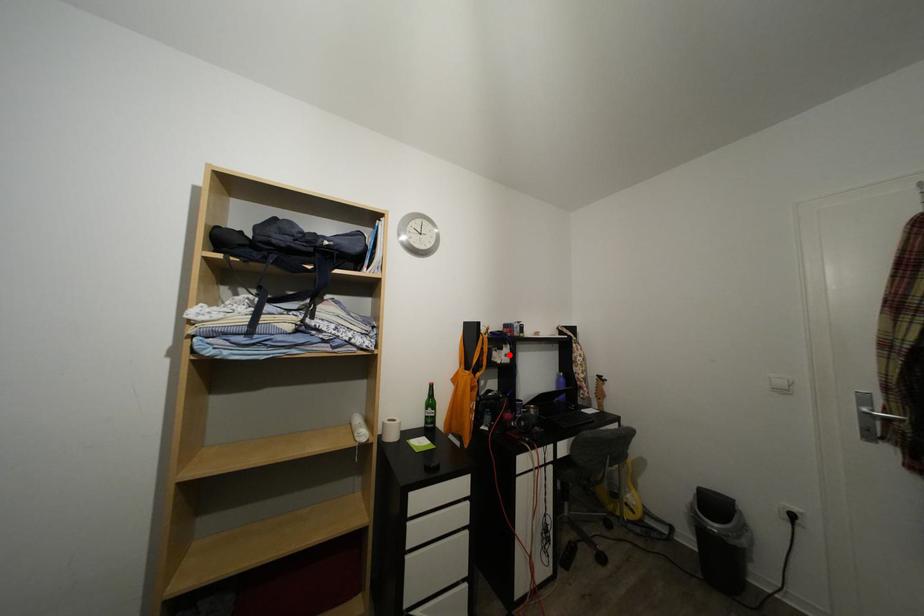
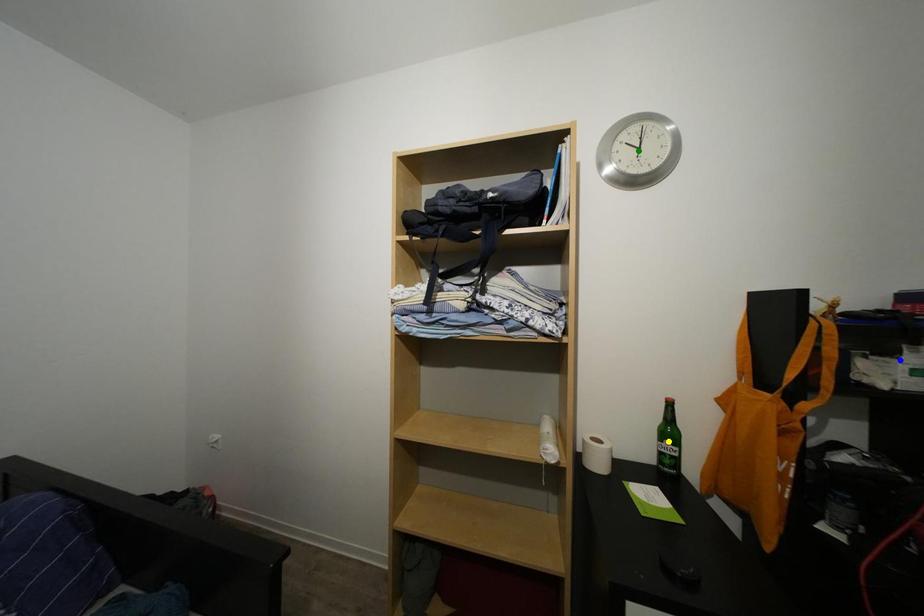
Question: I am providing you with two images of the same scene from different viewpoints. A red point is marked on the first image. You are given multiple points on the second image. Which point in image 2 is actually the same real-world point as the red point in image 1?

Choices:
 (A) yellow point
 (B) blue point
 (C) green point

Answer: (B)